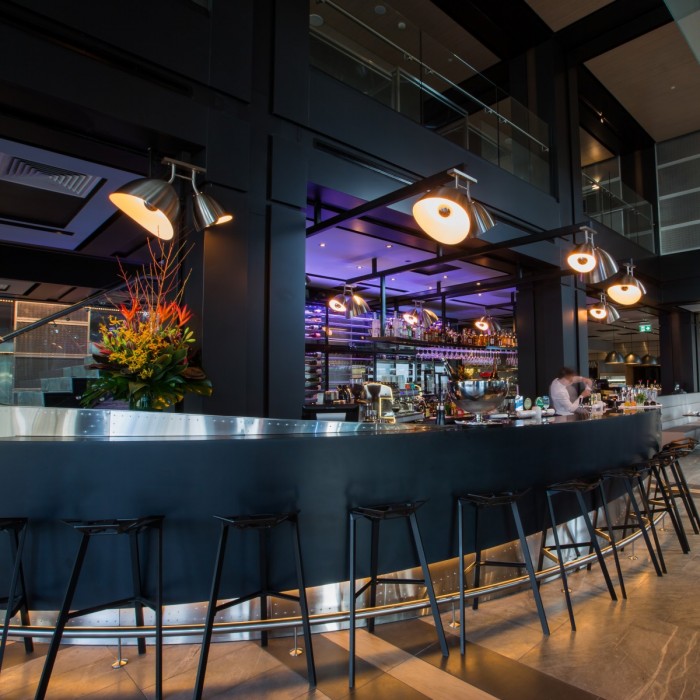
This screenshot has width=700, height=700. I want to click on bar taps, so click(x=416, y=400).